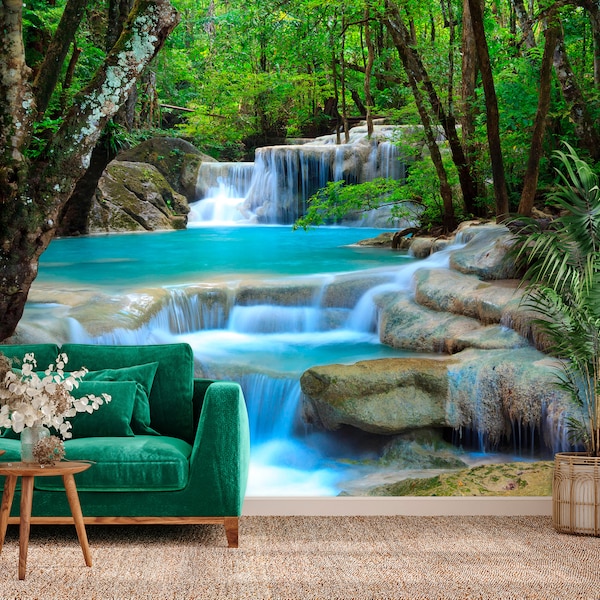
Find the location of a particular element. pillows is located at coordinates (141, 420), (111, 417), (142, 381).